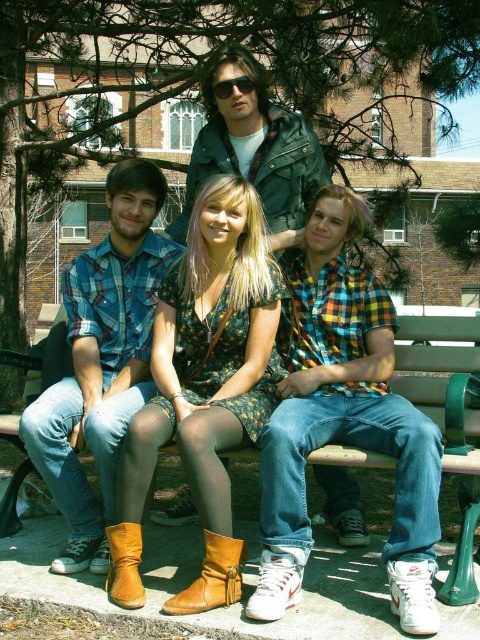
Question: Among these objects, which one is farthest from the camera?

Choices:
 (A) brown leather boot at lower center
 (B) matte plaid shirt at left

Answer: (B)

Question: Based on their relative distances, which object is nearer to the plaid cotton shirt at center?

Choices:
 (A) brown leather boot at lower center
 (B) brown suede boot at lower left

Answer: (A)

Question: Observing the image, what is the correct spatial positioning of floral dress at center in reference to leather jacket at upper center?

Choices:
 (A) below
 (B) above

Answer: (A)

Question: Estimate the real-world distances between objects in this image. Which object is farther from the brown suede boot at lower left?

Choices:
 (A) floral dress at center
 (B) leather jacket at upper center

Answer: (B)

Question: Is plaid cotton shirt at center above matte plaid shirt at left?

Choices:
 (A) yes
 (B) no

Answer: (B)

Question: Is the position of plaid cotton shirt at center less distant than that of wooden bench at center?

Choices:
 (A) yes
 (B) no

Answer: (A)